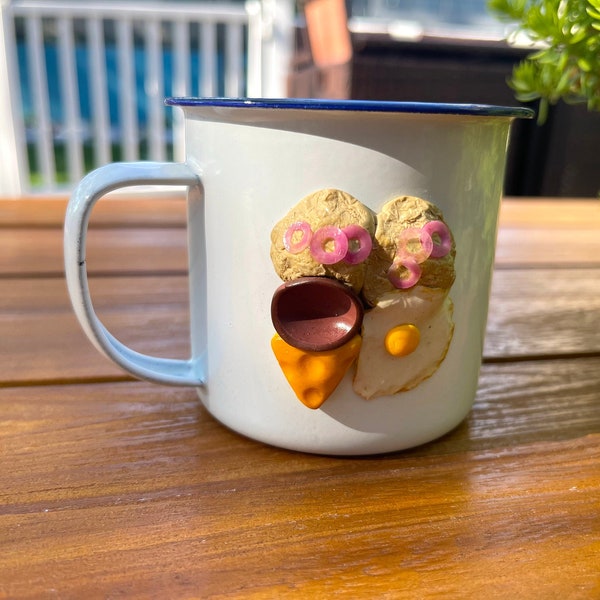
Image resolution: width=600 pixels, height=600 pixels. In order to click on egg sculpture on mug in this screenshot , I will do (x=401, y=380).